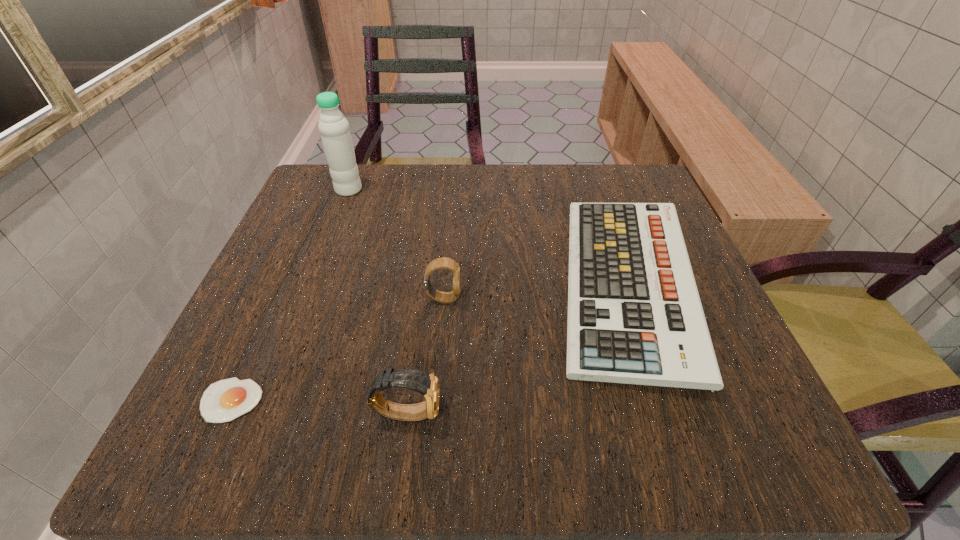
In the image, there is a desktop. Where is `vacant space at the far right corner`? Image resolution: width=960 pixels, height=540 pixels. vacant space at the far right corner is located at coordinates 658,193.

You are a GUI agent. You are given a task and a screenshot of the screen. Output one action in this format:
    pyautogui.click(x=<x>, y=<y>)
    Task: Click on the vacant space at the near right corner of the desktop
    Image resolution: width=960 pixels, height=540 pixels.
    Given the screenshot: What is the action you would take?
    click(698, 435)

Identify the location of unoccupied area between the tallest object and the nearer watch. The height and width of the screenshot is (540, 960). click(x=378, y=301).

In order to click on blank region between the fourth tallest object and the egg yolk in this screenshot , I will do `click(429, 342)`.

Locate an element on the screen. This screenshot has height=540, width=960. vacant point located between the farther watch and the rightmost object is located at coordinates (536, 291).

The image size is (960, 540). I want to click on unoccupied position between the fourth tallest object and the tallest object, so click(488, 237).

This screenshot has width=960, height=540. Find the location of `free space between the nearer watch and the farthest object`. free space between the nearer watch and the farthest object is located at coordinates point(378,301).

Identify the location of free point between the egg yolk and the computer keyboard. The image size is (960, 540). (429, 342).

Identify the location of empty location between the rightmost object and the nearer watch. Image resolution: width=960 pixels, height=540 pixels. (517, 348).

Find the location of a particular element. The height and width of the screenshot is (540, 960). empty space that is in between the farther watch and the computer keyboard is located at coordinates (536, 291).